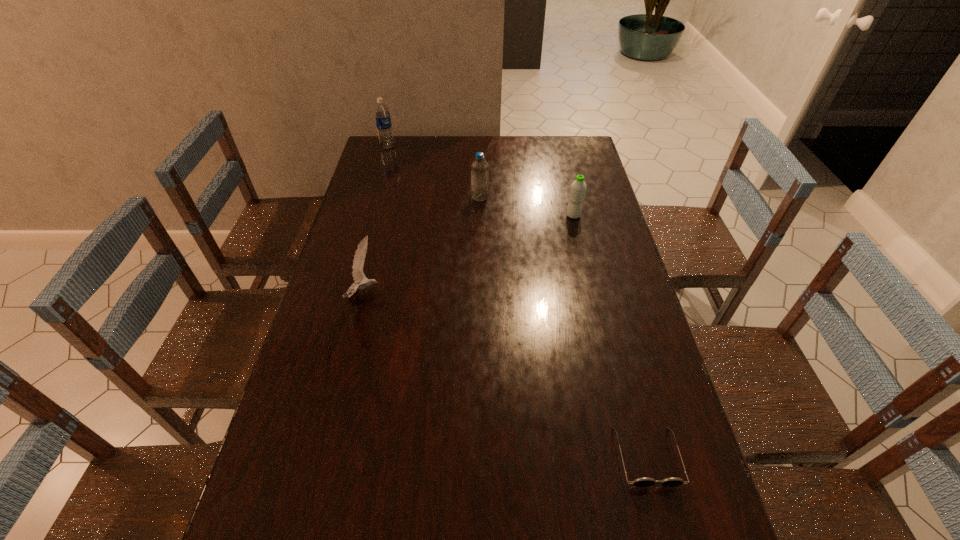
The width and height of the screenshot is (960, 540). What are the coordinates of `empty space between the second farthest water bottle and the leftmost water bottle` in the screenshot? It's located at (434, 172).

Locate an element on the screen. The width and height of the screenshot is (960, 540). empty location between the fourth farthest object and the second water bottle from left to right is located at coordinates (422, 246).

Identify the location of object that ranks as the second closest to the third object from right to left. Image resolution: width=960 pixels, height=540 pixels. click(x=359, y=258).

Locate an element on the screen. object that stands as the fourth closest to the shortest object is located at coordinates (382, 114).

Locate which water bottle is the third closest to the nearest object. Please provide its 2D coordinates. Your answer should be formatted as a tuple, i.e. [(x, y)], where the tuple contains the x and y coordinates of a point satisfying the conditions above.

[(382, 114)]

Select which water bottle appears as the second closest to the sunglasses. Please provide its 2D coordinates. Your answer should be formatted as a tuple, i.e. [(x, y)], where the tuple contains the x and y coordinates of a point satisfying the conditions above.

[(479, 168)]

Locate an element on the screen. vacant space that satisfies the following two spatial constraints: 1. on the front side of the leftmost water bottle; 2. on the left side of the rightmost water bottle is located at coordinates (368, 215).